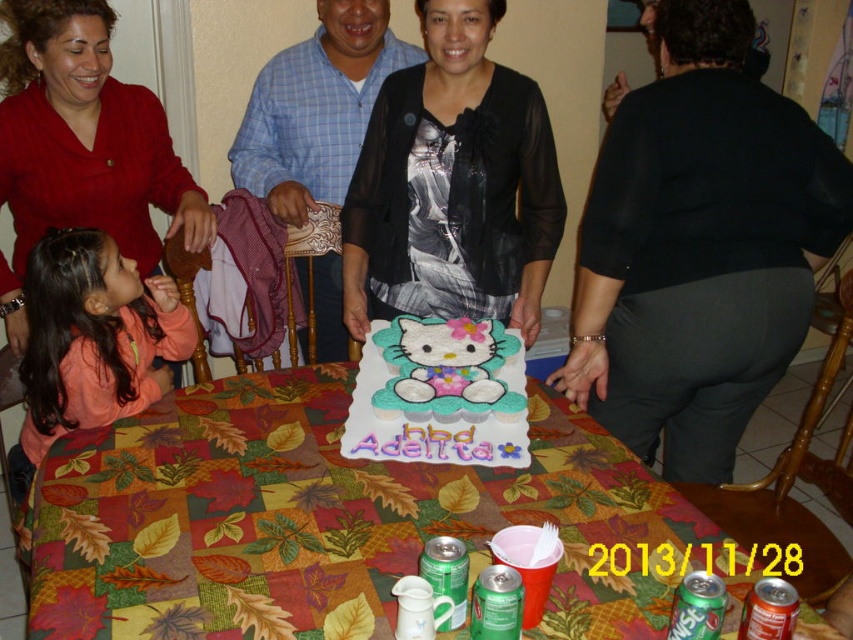
Question: Can you confirm if pink fleece jacket at lower left is positioned below matte white hello kitty cake at center?

Choices:
 (A) no
 (B) yes

Answer: (B)

Question: Can you confirm if multicolored fabric tablecloth at center is positioned below pink fleece jacket at lower left?

Choices:
 (A) yes
 (B) no

Answer: (A)

Question: Which of the following is the closest to the observer?

Choices:
 (A) matte white hello kitty cake at center
 (B) black fabric at center
 (C) multicolored fabric tablecloth at center
 (D) metallic red soda can at lower right

Answer: (D)

Question: Can you confirm if matte white hello kitty cake at center is bigger than green metallic can at lower center?

Choices:
 (A) yes
 (B) no

Answer: (A)

Question: Which of the following is the farthest from the observer?

Choices:
 (A) (502, 589)
 (B) (68, 346)
 (C) (753, 104)
 (D) (468, 442)

Answer: (C)

Question: Among these objects, which one is nearest to the camera?

Choices:
 (A) green metallic can at lower center
 (B) pink fleece jacket at lower left
 (C) black fabric at center

Answer: (A)